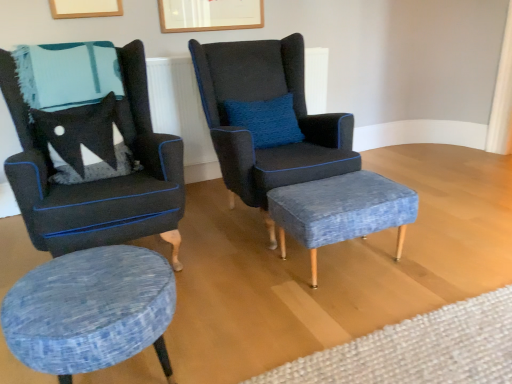
Where is `free spot in front of velvet dark blue armchair at center, the 2th chair when ordered from left to right`? This screenshot has height=384, width=512. free spot in front of velvet dark blue armchair at center, the 2th chair when ordered from left to right is located at coordinates (292, 298).